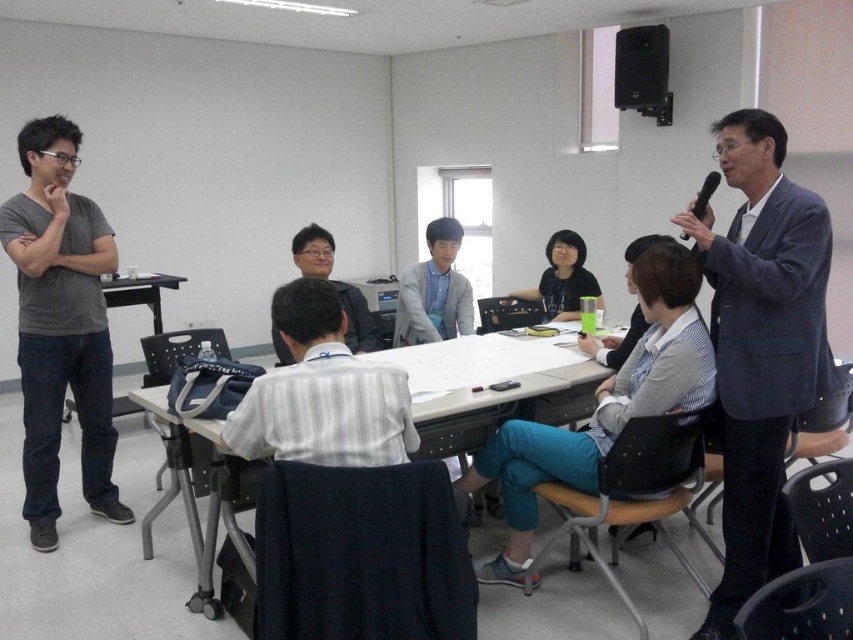
Question: Which object is positioned closest to the black plastic table at left?

Choices:
 (A) black plastic microphone at upper right
 (B) matte gray shirt at center

Answer: (B)

Question: Which of the following is the closest to the observer?

Choices:
 (A) black plastic table at left
 (B) matte gray sweater at center
 (C) white plastic table at center

Answer: (C)

Question: Is matte gray sweater at center behind matte gray shirt at center?

Choices:
 (A) no
 (B) yes

Answer: (B)

Question: Which object is the closest to the matte gray sweater at center?

Choices:
 (A) white plastic table at center
 (B) dark blue suit at upper right
 (C) matte gray shirt at center

Answer: (C)

Question: Is white striped shirt at center in front of white plastic table at center?

Choices:
 (A) yes
 (B) no

Answer: (A)

Question: Is dark blue suit at upper right behind gray matte t-shirt at left?

Choices:
 (A) no
 (B) yes

Answer: (A)